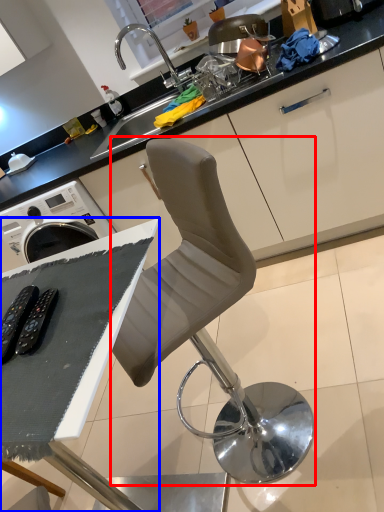
Question: Which object is closer to the camera taking this photo, chair (highlighted by a red box) or table (highlighted by a blue box)?

Choices:
 (A) chair
 (B) table

Answer: (B)